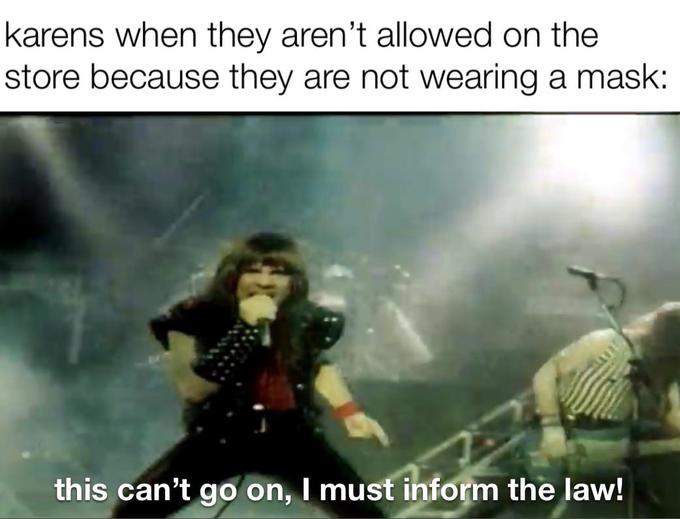
The image size is (680, 519). Find the location of `mic`. mic is located at coordinates (273, 326).